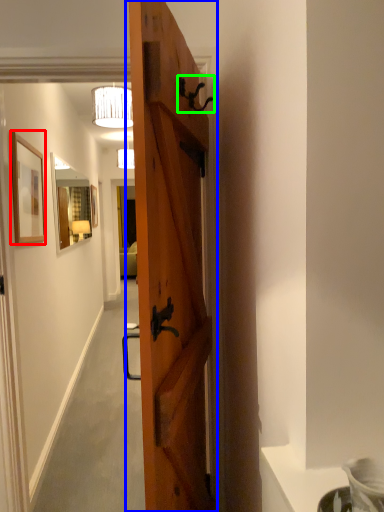
Question: Considering the real-world distances, which object is farthest from picture frame (highlighted by a red box)? door (highlighted by a blue box) or door handle (highlighted by a green box)?

Choices:
 (A) door
 (B) door handle

Answer: (A)